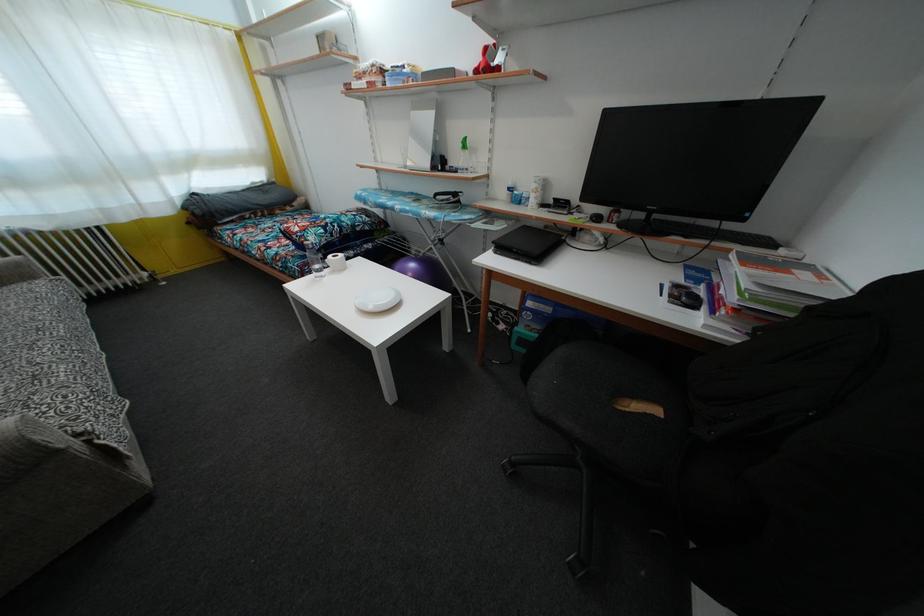
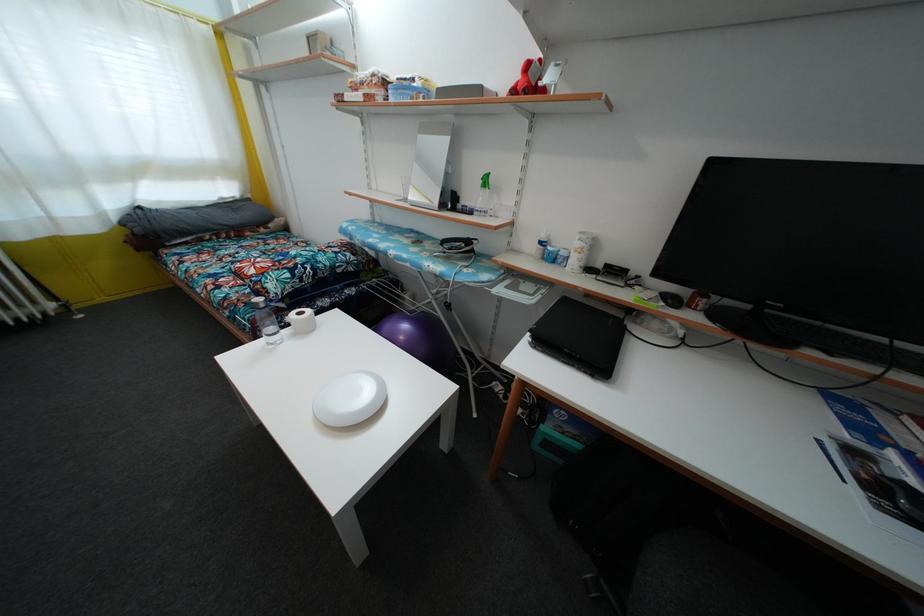
Question: The images are taken continuously from a first-person perspective. In which direction are you moving?

Choices:
 (A) Left
 (B) Right
 (C) Forward
 (D) Backward

Answer: (C)